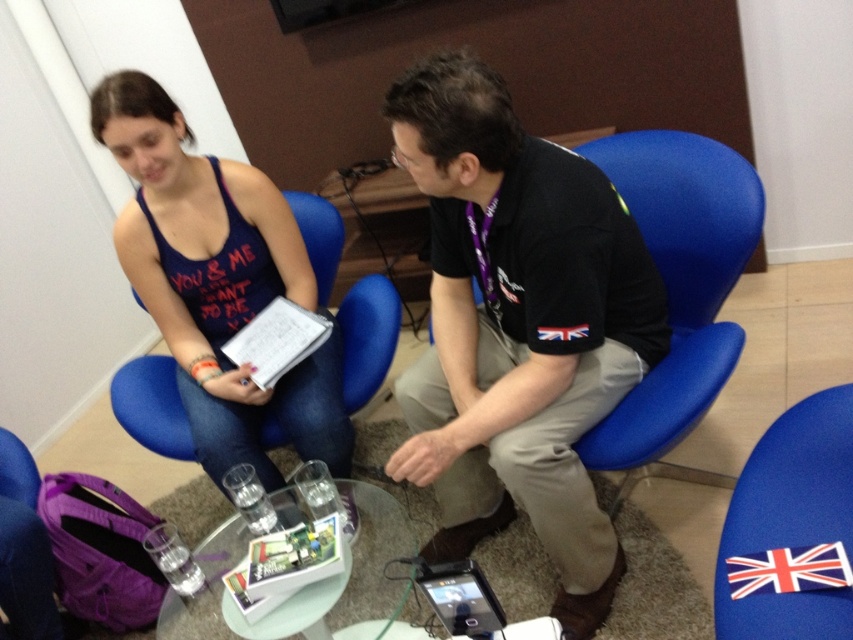
Based on the photo, does blue fabric chair at center come in front of white paper clipboard at center?

Yes.

Can you confirm if blue fabric chair at center is bigger than white paper clipboard at center?

Yes.

Measure the distance between blue fabric chair at center and camera.

blue fabric chair at center is 1.47 meters from camera.

The height and width of the screenshot is (640, 853). I want to click on blue fabric chair at center, so 677,282.

Between point (254, 268) and point (396, 589), which one is positioned in front?

Point (396, 589)

Between matte black tank top at upper left and transparent glass table at center, which one is positioned lower?

transparent glass table at center

What do you see at coordinates (218, 282) in the screenshot? I see `matte black tank top at upper left` at bounding box center [218, 282].

At what (x,y) coordinates should I click in order to perform the action: click on matte black tank top at upper left. Please return your answer as a coordinate pair (x, y). Looking at the image, I should click on click(218, 282).

Is blue fabric chair at center to the right of transparent glass table at center from the viewer's perspective?

Correct, you'll find blue fabric chair at center to the right of transparent glass table at center.

Where is `blue fabric chair at center`? The width and height of the screenshot is (853, 640). blue fabric chair at center is located at coordinates (677, 282).